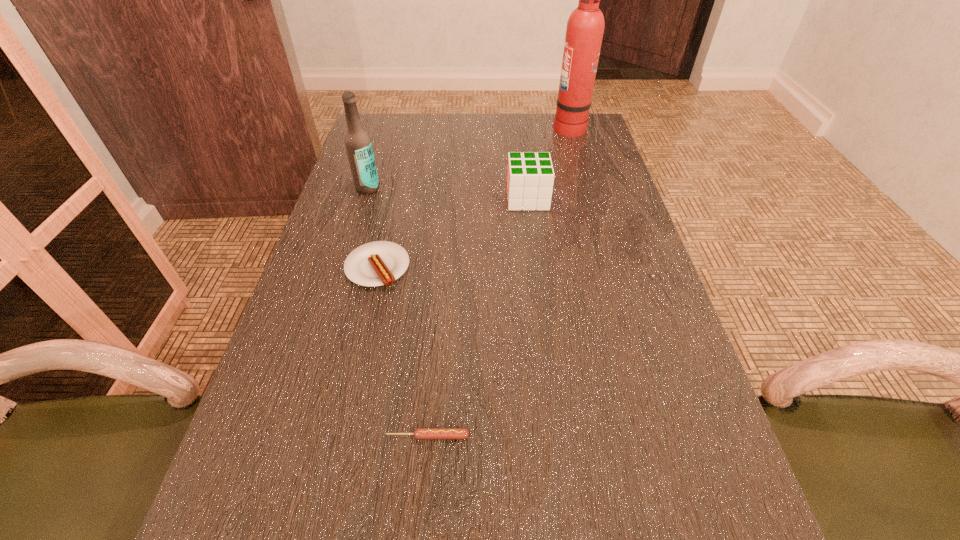
Identify the location of vacant space situated 0.300m on the label side of the tallest object. The height and width of the screenshot is (540, 960). (461, 126).

You are a GUI agent. You are given a task and a screenshot of the screen. Output one action in this format:
    pyautogui.click(x=<x>, y=<y>)
    Task: Click on the vacant space located on the label side of the tallest object
    This screenshot has height=540, width=960.
    Given the screenshot: What is the action you would take?
    pyautogui.click(x=494, y=126)

I want to click on vacant space located 0.290m on the label of the beer bottle, so click(342, 273).

Locate an element on the screen. This screenshot has width=960, height=540. vacant space located on the red face of the third tallest object is located at coordinates (405, 198).

At what (x,y) coordinates should I click in order to perform the action: click on free space located 0.080m on the red face of the third tallest object. Please return your answer as a coordinate pair (x, y). The width and height of the screenshot is (960, 540). Looking at the image, I should click on (477, 198).

This screenshot has height=540, width=960. I want to click on vacant space located on the red face of the third tallest object, so click(378, 198).

Identify the location of vacant point located on the right of the left sausage. The width and height of the screenshot is (960, 540). (562, 268).

This screenshot has height=540, width=960. What are the coordinates of `vacant area situated 0.310m on the back of the nearer sausage` in the screenshot? It's located at (441, 291).

At what (x,y) coordinates should I click in order to perform the action: click on object at the far edge. Please return your answer as a coordinate pair (x, y). This screenshot has width=960, height=540. Looking at the image, I should click on (585, 27).

Where is `beer bottle at the left edge`? The height and width of the screenshot is (540, 960). beer bottle at the left edge is located at coordinates (358, 144).